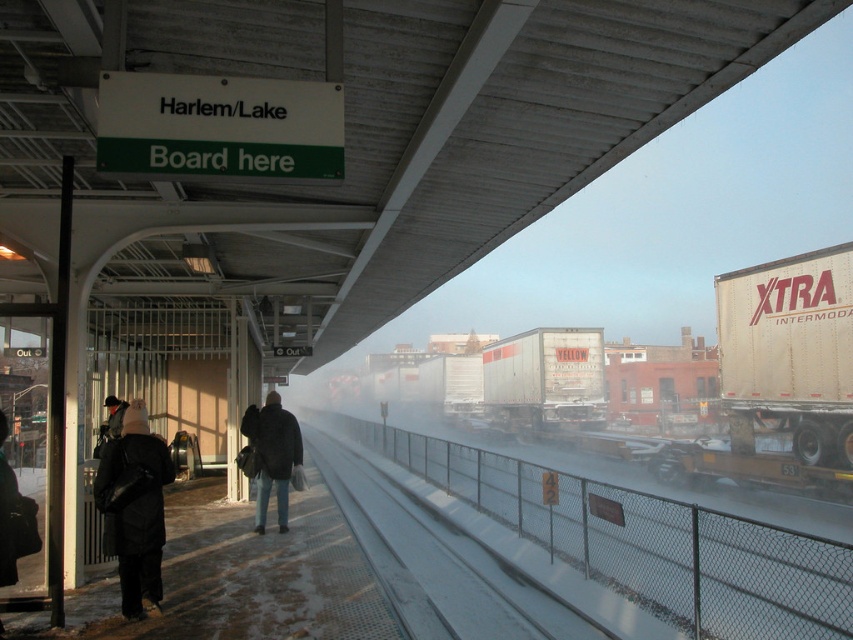
You are standing on the Harlem Lake train platform and want to take a photo of both point (x=805, y=401) and point (x=515, y=362). Since you want both points to be in focus, which point should you focus on to ensure both are sharp?

You should focus on point (x=515, y=362) because it is farther from the camera than point (x=805, y=401). By focusing on the farther point, the closer point will also be within the depth of field, ensuring both are sharp.

You are a delivery person carrying a box that is 4 meters long. You need to place it between the dark gray jacket at center and the dark gray jacket at left on the platform. Is there enough space to fit the box between them?

The dark gray jacket at center and the dark gray jacket at left are 4.19 meters apart, so yes, the box that is 4 meters long can fit between them since the distance is slightly larger than the box.

You are a passenger on the Harlem Lake platform. You see the yellow matte trailer truck at center and the dark gray jacket at left. Which object is closer to the front of the platform?

The yellow matte trailer truck at center is closer to the front of the platform because the dark gray jacket at left is behind it.